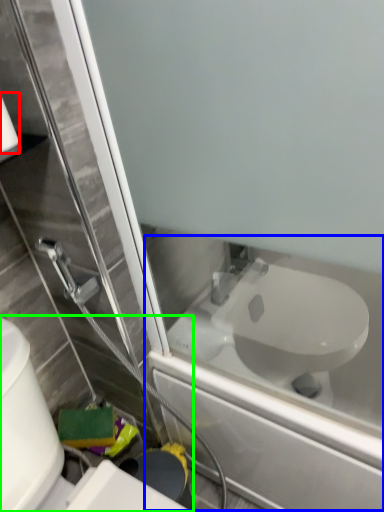
Question: Which is nearer to the toilet paper (highlighted by a red box)? bath (highlighted by a blue box) or toilet (highlighted by a green box).

Choices:
 (A) bath
 (B) toilet

Answer: (B)